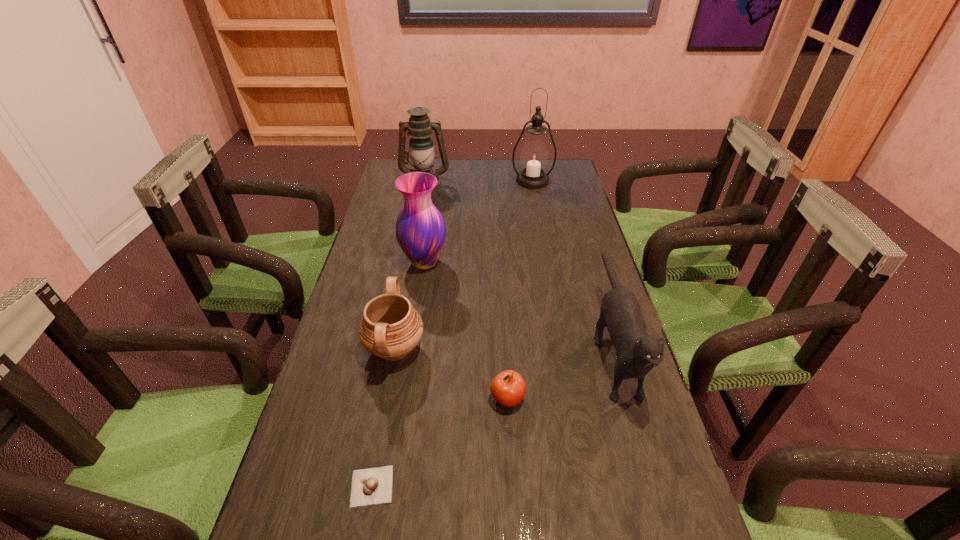
The height and width of the screenshot is (540, 960). I want to click on free space located on the front of the taller oil lamp, so coord(544,246).

Locate an element on the screen. vacant space located 0.250m on the right of the left oil lamp is located at coordinates (513, 183).

Locate an element on the screen. This screenshot has height=540, width=960. free space located on the front of the vase is located at coordinates (408, 370).

You are a GUI agent. You are given a task and a screenshot of the screen. Output one action in this format:
    pyautogui.click(x=<x>, y=<y>)
    Task: Click on the vacant area situated 0.070m on the front-facing side of the cat
    Image resolution: width=960 pixels, height=540 pixels.
    Given the screenshot: What is the action you would take?
    pyautogui.click(x=642, y=451)

Identify the location of vacant space located on the front-facing side of the fifth tallest object. This screenshot has width=960, height=540. (544, 349).

You are a GUI agent. You are given a task and a screenshot of the screen. Output one action in this format:
    pyautogui.click(x=<x>, y=<y>)
    Task: Click on the vacant space located on the back of the third object from right to left
    This screenshot has width=960, height=540.
    Given the screenshot: What is the action you would take?
    pyautogui.click(x=501, y=285)

Identify the location of free spot located 0.360m on the back of the garlic. Image resolution: width=960 pixels, height=540 pixels. (400, 332).

Identify the location of oil lamp that is at the left edge. (421, 146).

What are the coordinates of `vase present at the left edge` in the screenshot? It's located at (420, 228).

You are a GUI agent. You are given a task and a screenshot of the screen. Output one action in this format:
    pyautogui.click(x=<x>, y=<y>)
    Task: Click on the urn that is at the left edge
    The height and width of the screenshot is (540, 960).
    Given the screenshot: What is the action you would take?
    pyautogui.click(x=390, y=328)